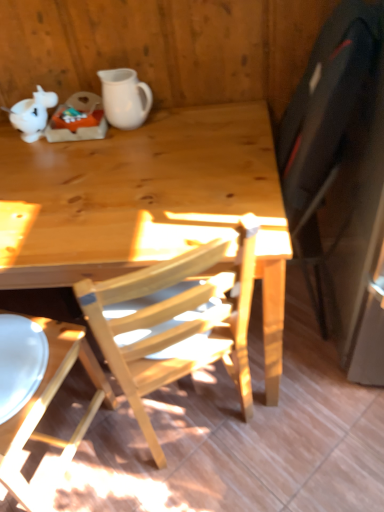
Question: Can you confirm if wooden chair at lower left is thinner than natural wood desk at center?

Choices:
 (A) no
 (B) yes

Answer: (B)

Question: Are wooden chair at lower left and natural wood desk at center located far from each other?

Choices:
 (A) no
 (B) yes

Answer: (A)

Question: From a real-world perspective, is wooden chair at lower left on natural wood desk at center?

Choices:
 (A) no
 (B) yes

Answer: (B)

Question: From the image's perspective, is wooden chair at lower left above natural wood desk at center?

Choices:
 (A) yes
 (B) no

Answer: (B)

Question: Is wooden chair at lower left closer to the viewer compared to natural wood desk at center?

Choices:
 (A) no
 (B) yes

Answer: (B)

Question: Which is correct: wooden chair at lower left is inside white matte teapot at upper left, or outside of it?

Choices:
 (A) outside
 (B) inside

Answer: (A)

Question: Considering the relative positions of wooden chair at lower left and white matte teapot at upper left in the image provided, is wooden chair at lower left to the left or to the right of white matte teapot at upper left?

Choices:
 (A) right
 (B) left

Answer: (B)

Question: In the image, is wooden chair at lower left positioned in front of or behind white matte teapot at upper left?

Choices:
 (A) behind
 (B) front

Answer: (B)

Question: Looking at the image, does wooden chair at lower left seem bigger or smaller compared to white matte teapot at upper left?

Choices:
 (A) big
 (B) small

Answer: (A)

Question: Considering the positions of wooden chair at lower left and natural wood desk at center in the image, is wooden chair at lower left wider or thinner than natural wood desk at center?

Choices:
 (A) wide
 (B) thin

Answer: (B)

Question: Is point (18, 416) closer or farther from the camera than point (67, 233)?

Choices:
 (A) closer
 (B) farther

Answer: (A)

Question: From the image's perspective, is wooden chair at lower left above or below natural wood desk at center?

Choices:
 (A) below
 (B) above

Answer: (A)

Question: From a real-world perspective, is wooden chair at lower left physically located above or below natural wood desk at center?

Choices:
 (A) above
 (B) below

Answer: (A)

Question: Is point (18, 104) positioned closer to the camera than point (21, 351)?

Choices:
 (A) closer
 (B) farther

Answer: (B)

Question: Based on their positions, is white matte teapot at upper left located to the left or right of wooden chair at lower left?

Choices:
 (A) left
 (B) right

Answer: (B)